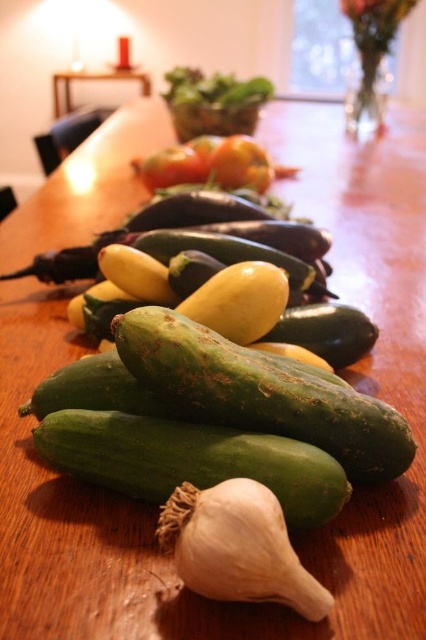
Question: Which point is closer to the camera?

Choices:
 (A) (322, 483)
 (B) (198, 500)
 (C) (149, 93)
 (D) (226, 180)

Answer: (B)

Question: Which object is positioned farthest from the green rough cucumber at center?

Choices:
 (A) green matte cucumber at center
 (B) wooden table at upper center

Answer: (B)

Question: Can you confirm if green rough cucumber at center is positioned above green matte cucumber at center?

Choices:
 (A) no
 (B) yes

Answer: (B)

Question: Considering the relative positions of smooth orange squash at center and wooden table at upper center in the image provided, where is smooth orange squash at center located with respect to wooden table at upper center?

Choices:
 (A) below
 (B) above

Answer: (A)

Question: Based on their relative distances, which object is farther from the wooden table at upper center?

Choices:
 (A) smooth orange squash at center
 (B) green rough cucumber at center
 (C) white matte garlic at lower center
 (D) green matte cucumber at center

Answer: (C)

Question: Considering the relative positions of green matte cucumber at center and white matte garlic at lower center in the image provided, where is green matte cucumber at center located with respect to white matte garlic at lower center?

Choices:
 (A) below
 (B) above

Answer: (B)